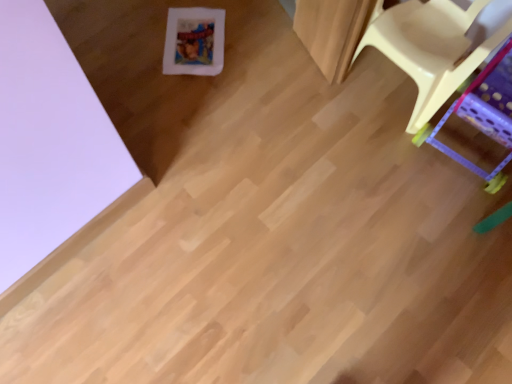
The height and width of the screenshot is (384, 512). Identify the location of vacant area that is in front of yellow plastic chair at right, which appears as the 1th furniture when viewed from the right. (451, 232).